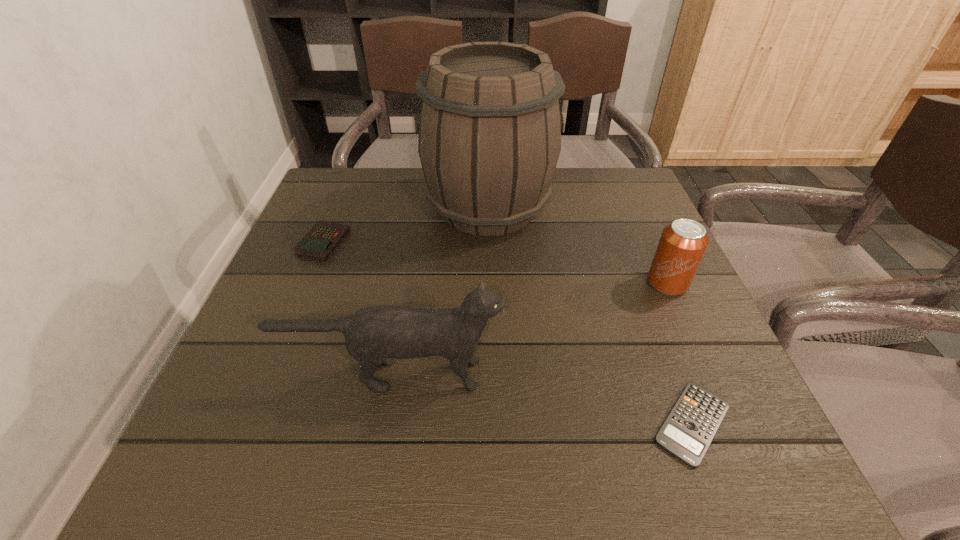
The image size is (960, 540). I want to click on blank region between the left calculator and the shorter calculator, so click(x=508, y=333).

Where is `free space between the left calculator and the third tallest object`? free space between the left calculator and the third tallest object is located at coordinates (495, 262).

I want to click on blank region between the taller calculator and the wine bucket, so click(x=406, y=225).

Locate an element on the screen. This screenshot has height=540, width=960. free space between the left calculator and the wine bucket is located at coordinates (406, 225).

At what (x,y) coordinates should I click in order to perform the action: click on vacant area between the cat and the third nearest object. Please return your answer as a coordinate pair (x, y). Looking at the image, I should click on (530, 329).

This screenshot has height=540, width=960. I want to click on the closest object relative to the shorter calculator, so click(x=682, y=245).

Identify the location of object that is the fourth closest to the wine bucket. (690, 427).

Where is `free space that satisfies the following two spatial constraints: 1. on the back side of the shorter calculator; 2. on the right side of the can`? The image size is (960, 540). free space that satisfies the following two spatial constraints: 1. on the back side of the shorter calculator; 2. on the right side of the can is located at coordinates (639, 283).

You are a GUI agent. You are given a task and a screenshot of the screen. Output one action in this format:
    pyautogui.click(x=<x>, y=<y>)
    Task: Click on the vacant space that satisfies the following two spatial constraints: 1. on the front side of the taller calculator; 2. on the right side of the shorter calculator
    The height and width of the screenshot is (540, 960).
    Given the screenshot: What is the action you would take?
    pyautogui.click(x=248, y=423)

Find the location of a particular element. free space that satisfies the following two spatial constraints: 1. on the front side of the left calculator; 2. on the left side of the third tallest object is located at coordinates (306, 283).